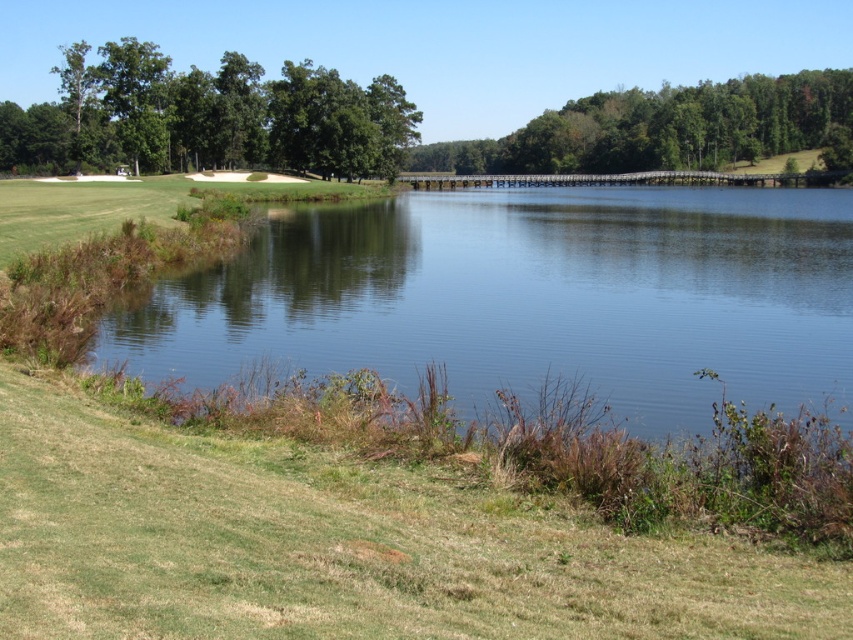
Does green grass at lower left appear on the right side of green leafy trees at upper right?

Incorrect, green grass at lower left is not on the right side of green leafy trees at upper right.

Which is above, green grass at lower left or green leafy trees at upper right?

Positioned higher is green leafy trees at upper right.

Describe the element at coordinates (341, 545) in the screenshot. The width and height of the screenshot is (853, 640). I see `green grass at lower left` at that location.

In order to click on green grass at lower left in this screenshot , I will do `click(341, 545)`.

Is green grass at lower left shorter than clear water at center?

Indeed, green grass at lower left has a lesser height compared to clear water at center.

Can you confirm if green grass at lower left is positioned to the left of clear water at center?

Indeed, green grass at lower left is positioned on the left side of clear water at center.

Locate an element on the screen. The width and height of the screenshot is (853, 640). green grass at lower left is located at coordinates (341, 545).

Based on the photo, which of these two, clear water at center or green leafy trees at upper right, stands shorter?

clear water at center is shorter.

Looking at this image, between clear water at center and green leafy trees at upper right, which one is positioned lower?

clear water at center is below.

Is point (135, 362) closer to camera compared to point (608, 141)?

Yes.

Find the location of a particular element. clear water at center is located at coordinates (529, 300).